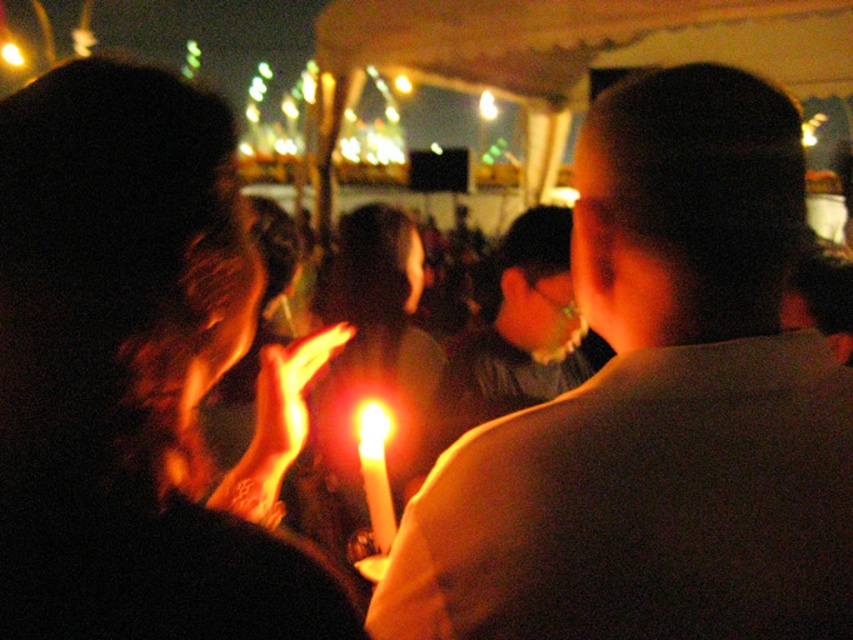
Question: Does matte white candle at center have a lesser width compared to white wax candle at center?

Choices:
 (A) yes
 (B) no

Answer: (B)

Question: Is matte white candle at center above matte black candle at center?

Choices:
 (A) no
 (B) yes

Answer: (A)

Question: Does matte white candle at center have a greater width compared to white wax candle at center?

Choices:
 (A) yes
 (B) no

Answer: (A)

Question: Which point is closer to the camera?

Choices:
 (A) matte white candle at center
 (B) white wax candle at center

Answer: (A)

Question: Which of the following is the closest to the observer?

Choices:
 (A) matte white candle at center
 (B) matte black candle at center
 (C) white wax candle at center

Answer: (B)

Question: Which of the following is the farthest from the observer?

Choices:
 (A) (128, 99)
 (B) (762, 292)
 (C) (376, 428)

Answer: (C)